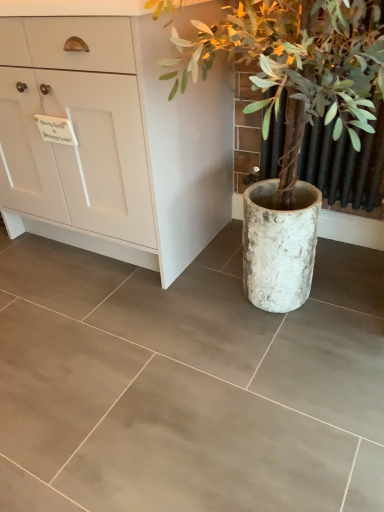
I want to click on white textured pot at right, so click(297, 67).

The image size is (384, 512). What do you see at coordinates (297, 67) in the screenshot? I see `white textured pot at right` at bounding box center [297, 67].

Measure the distance between point (92, 175) and camera.

Point (92, 175) and camera are 1.46 meters apart.

Identify the location of white matte cabinet at left. (113, 142).

What do you see at coordinates (113, 142) in the screenshot? I see `white matte cabinet at left` at bounding box center [113, 142].

Locate an element on the screen. white textured pot at right is located at coordinates (297, 67).

Is white textured pot at right to the left of white matte cabinet at left from the viewer's perspective?

No, white textured pot at right is not to the left of white matte cabinet at left.

Considering their positions, is white textured pot at right located in front of or behind white matte cabinet at left?

Clearly, white textured pot at right is in front of white matte cabinet at left.

Is point (280, 248) more distant than point (22, 172)?

No, it is not.

From the image's perspective, does white textured pot at right appear lower than white matte cabinet at left?

Yes.

From a real-world perspective, is white textured pot at right positioned over white matte cabinet at left based on gravity?

Indeed, from a real-world perspective, white textured pot at right stands above white matte cabinet at left.

Considering the relative sizes of white textured pot at right and white matte cabinet at left in the image provided, is white textured pot at right wider than white matte cabinet at left?

Incorrect, the width of white textured pot at right does not surpass that of white matte cabinet at left.

Consider the image. Which of these two, white textured pot at right or white matte cabinet at left, stands taller?

white textured pot at right is taller.

In terms of size, does white textured pot at right appear bigger or smaller than white matte cabinet at left?

In the image, white textured pot at right appears to be smaller than white matte cabinet at left.

Is white textured pot at right situated inside white matte cabinet at left or outside?

white textured pot at right is spatially situated outside white matte cabinet at left.

Is white textured pot at right in contact with white matte cabinet at left?

No, white textured pot at right is not with white matte cabinet at left.

Is white textured pot at right facing towards white matte cabinet at left?

No, white textured pot at right is not oriented towards white matte cabinet at left.

How many degrees apart are the facing directions of white textured pot at right and white matte cabinet at left?

The angular difference between white textured pot at right and white matte cabinet at left is 3.08 degrees.

The height and width of the screenshot is (512, 384). I want to click on chest of drawers above the white textured pot at right (from the image's perspective), so click(x=113, y=142).

Is white matte cabinet at left at the left side of white textured pot at right?

Correct, you'll find white matte cabinet at left to the left of white textured pot at right.

Which object is closer to the camera, white matte cabinet at left or white textured pot at right?

white textured pot at right is more forward.

Which is further, (90, 214) or (297, 183)?

The point (90, 214) is more distant.

From the image's perspective, is white matte cabinet at left positioned above or below white textured pot at right?

Clearly, from the image's perspective, white matte cabinet at left is above white textured pot at right.

From a real-world perspective, is white matte cabinet at left over white textured pot at right?

No, from a real-world perspective, white matte cabinet at left is not on top of white textured pot at right.

In terms of width, does white matte cabinet at left look wider or thinner when compared to white textured pot at right?

Considering their sizes, white matte cabinet at left looks broader than white textured pot at right.

Is white matte cabinet at left taller or shorter than white textured pot at right?

white matte cabinet at left is shorter than white textured pot at right.

Considering the relative sizes of white matte cabinet at left and white textured pot at right in the image provided, is white matte cabinet at left smaller than white textured pot at right?

Actually, white matte cabinet at left might be larger than white textured pot at right.

Choose the correct answer: Is white matte cabinet at left inside white textured pot at right or outside it?

white matte cabinet at left is spatially situated outside white textured pot at right.

Would you consider white matte cabinet at left to be distant from white textured pot at right?

No, white matte cabinet at left is not far from white textured pot at right.

Is white matte cabinet at left facing towards white textured pot at right?

No.

How many degrees apart are the facing directions of white matte cabinet at left and white textured pot at right?

3.08 degrees separate the facing orientations of white matte cabinet at left and white textured pot at right.

Measure the distance between white matte cabinet at left and white textured pot at right.

white matte cabinet at left and white textured pot at right are 37.13 centimeters apart from each other.

What are the coordinates of `the chest of drawers that appears above the white textured pot at right (from the image's perspective)` in the screenshot? It's located at (113, 142).

Where is `the chest of drawers that appears below the white textured pot at right (from a real-world perspective)`? The height and width of the screenshot is (512, 384). the chest of drawers that appears below the white textured pot at right (from a real-world perspective) is located at coordinates (113, 142).

Locate an element on the screen. Image resolution: width=384 pixels, height=512 pixels. houseplant that is above the white matte cabinet at left (from a real-world perspective) is located at coordinates (297, 67).